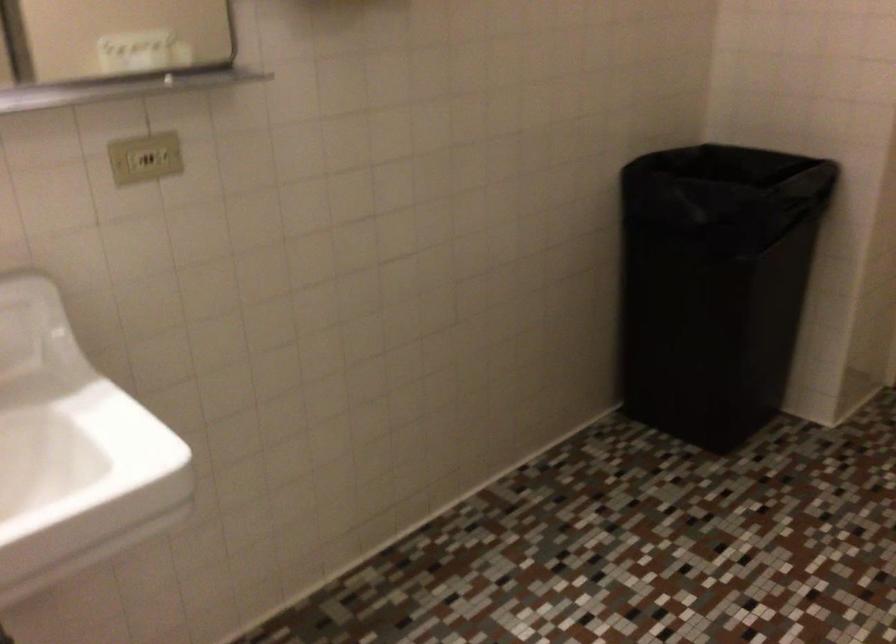
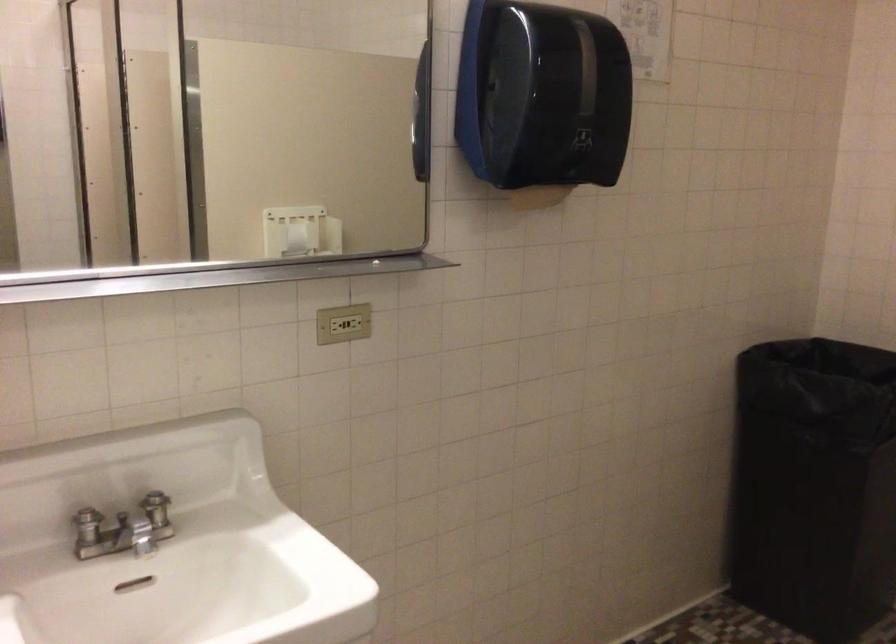
The images are taken continuously from a first-person perspective. In which direction are you moving?

The movement direction of the cameraman is left, backward.